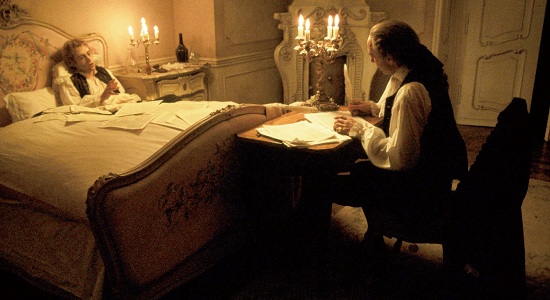
Image resolution: width=550 pixels, height=300 pixels. Identify the location of bed. (165, 125).